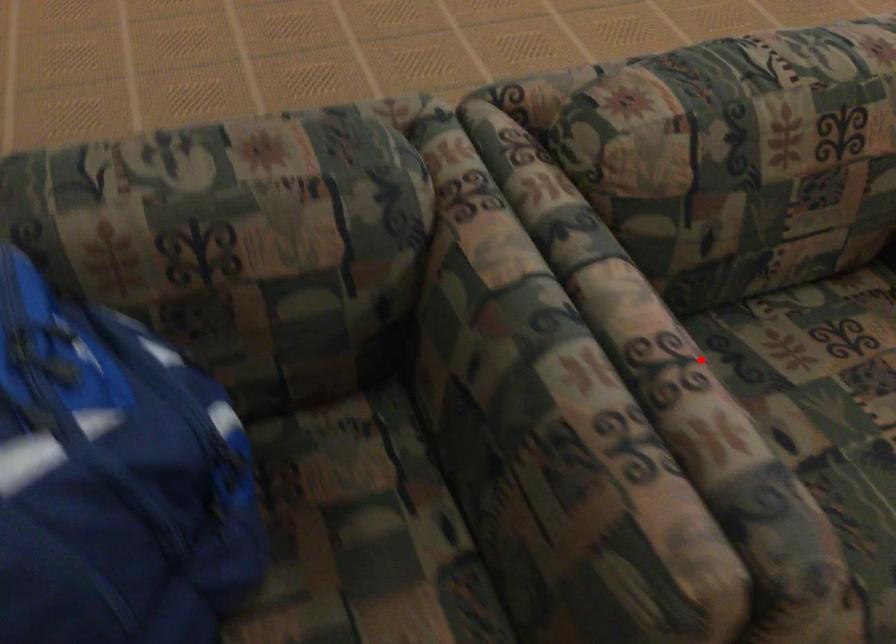
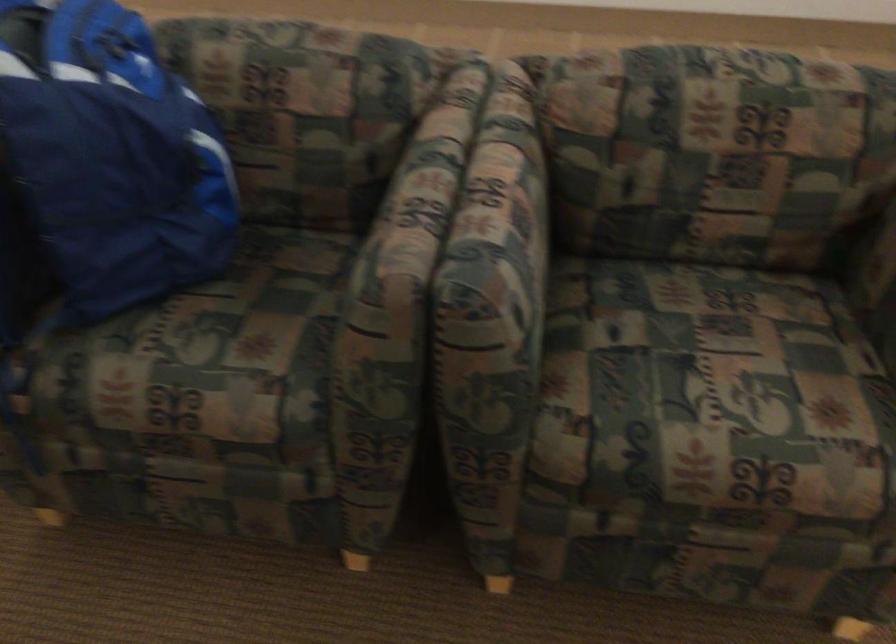
Find the pixel in the second image that matches the highlighted location in the first image.

(510, 196)